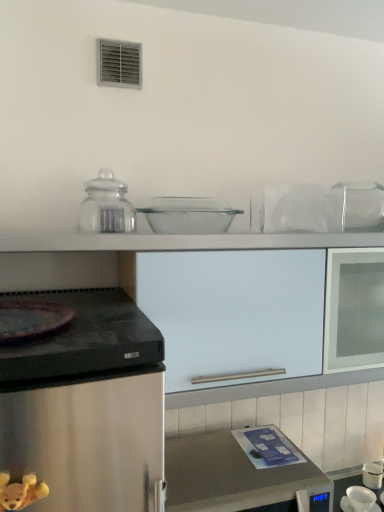
At what (x,y) coordinates should I click in order to perform the action: click on white matte cabinet at center. Please return your answer as a coordinate pair (x, y). The height and width of the screenshot is (512, 384). Looking at the image, I should click on (231, 325).

Measure the distance between point (x=156, y=203) and camera.

Point (x=156, y=203) and camera are 1.46 meters apart from each other.

What is the approximate height of transparent glass jar at upper center?

transparent glass jar at upper center is 6.88 inches tall.

What do you see at coordinates (20, 492) in the screenshot? I see `brown plush bear at lower left` at bounding box center [20, 492].

Image resolution: width=384 pixels, height=512 pixels. I want to click on white matte cabinet at center, so click(231, 325).

Is transparent glass jar at upper center surrounded by white glossy cup at lower right, which is the first appliance from right to left?

No.

Which of these two, white glossy cup at lower right, which is the first appliance from right to left, or transparent glass jar at upper center, is bigger?

Bigger between the two is transparent glass jar at upper center.

Is white glossy cup at lower right, which ranks as the 2th appliance in front-to-back order, facing away from transparent glass jar at upper center?

No.

The image size is (384, 512). Identify the location of home appliance below the white matte cabinet at center (from the image's perspective). (235, 477).

Can we say metallic stainless steel microwave at lower center lies outside white matte cabinet at center?

That's correct, metallic stainless steel microwave at lower center is outside of white matte cabinet at center.

Considering the sizes of objects metallic stainless steel microwave at lower center and white matte cabinet at center in the image provided, who is wider, metallic stainless steel microwave at lower center or white matte cabinet at center?

With larger width is metallic stainless steel microwave at lower center.

Is metallic stainless steel microwave at lower center turned away from white matte cabinet at center?

No, white matte cabinet at center is not at the back of metallic stainless steel microwave at lower center.

Do you think white matte cabinet at center is within white glossy cup at lower right, which is the second appliance from left to right, or outside of it?

white matte cabinet at center is located beyond the bounds of white glossy cup at lower right, which is the second appliance from left to right.

Is white matte cabinet at center aimed at white glossy cup at lower right, which appears as the 2th appliance when viewed from the top?

No, white matte cabinet at center is not turned towards white glossy cup at lower right, which appears as the 2th appliance when viewed from the top.

I want to click on cabinetry on the left of white glossy cup at lower right, which is the first appliance from right to left, so (x=231, y=325).

From the image's perspective, is white matte cabinet at center on white glossy cup at lower right, which is the second appliance from left to right?

Correct, white matte cabinet at center appears higher than white glossy cup at lower right, which is the second appliance from left to right, in the image.

From the picture: Is the position of white glossy cup at lower right, which appears as the 2th appliance when viewed from the top, more distant than that of clear glass bowl at center, which is the first appliance from front to back?

Yes, it is behind clear glass bowl at center, which is the first appliance from front to back.

Considering the relative sizes of white glossy cup at lower right, which is the second appliance from left to right, and clear glass bowl at center, acting as the 1th appliance starting from the left, in the image provided, is white glossy cup at lower right, which is the second appliance from left to right, wider than clear glass bowl at center, acting as the 1th appliance starting from the left,?

Incorrect, the width of white glossy cup at lower right, which is the second appliance from left to right, does not surpass that of clear glass bowl at center, acting as the 1th appliance starting from the left.

Considering the relative positions of white glossy cup at lower right, which is the first appliance from right to left, and clear glass bowl at center, which appears as the second appliance when viewed from the back, in the image provided, is white glossy cup at lower right, which is the first appliance from right to left, to the right of clear glass bowl at center, which appears as the second appliance when viewed from the back, from the viewer's perspective?

Correct, you'll find white glossy cup at lower right, which is the first appliance from right to left, to the right of clear glass bowl at center, which appears as the second appliance when viewed from the back.

Could you tell me if white glossy cup at lower right, which appears as the 2th appliance when viewed from the top, is facing clear glass bowl at center, which is the 1th appliance from top to bottom?

No, white glossy cup at lower right, which appears as the 2th appliance when viewed from the top, is not turned towards clear glass bowl at center, which is the 1th appliance from top to bottom.

Are clear glass bowl at center, which is the 1th appliance from top to bottom, and white matte cabinet at center located far from each other?

No, clear glass bowl at center, which is the 1th appliance from top to bottom, is not far from white matte cabinet at center.

Considering the sizes of objects clear glass bowl at center, which is the first appliance from front to back, and white matte cabinet at center in the image provided, who is wider, clear glass bowl at center, which is the first appliance from front to back, or white matte cabinet at center?

white matte cabinet at center.

Identify the location of cabinetry that is in front of the clear glass bowl at center, which is the 1th appliance from top to bottom. (231, 325).

From a real-world perspective, which is physically below, white glossy cup at lower right, which is the first appliance from right to left, or brown plush bear at lower left?

From a 3D spatial view, white glossy cup at lower right, which is the first appliance from right to left, is below.

From the picture: Does white glossy cup at lower right, which ranks as the 2th appliance in front-to-back order, turn towards brown plush bear at lower left?

No, white glossy cup at lower right, which ranks as the 2th appliance in front-to-back order, is not aimed at brown plush bear at lower left.

Considering the relative positions of white glossy cup at lower right, positioned as the first appliance in bottom-to-top order, and brown plush bear at lower left in the image provided, is white glossy cup at lower right, positioned as the first appliance in bottom-to-top order, to the left of brown plush bear at lower left from the viewer's perspective?

In fact, white glossy cup at lower right, positioned as the first appliance in bottom-to-top order, is to the right of brown plush bear at lower left.

From the image's perspective, is white glossy cup at lower right, which ranks as the 2th appliance in front-to-back order, over brown plush bear at lower left?

No, from the image's perspective, white glossy cup at lower right, which ranks as the 2th appliance in front-to-back order, is not on top of brown plush bear at lower left.

In the scene shown: Is metallic stainless steel microwave at lower center turned away from brown plush bear at lower left?

metallic stainless steel microwave at lower center does not have its back to brown plush bear at lower left.

Which object is positioned more to the right, metallic stainless steel microwave at lower center or brown plush bear at lower left?

Positioned to the right is metallic stainless steel microwave at lower center.

Is point (332, 487) closer or farther from the camera than point (1, 475)?

Point (332, 487) is farther from the camera than point (1, 475).

Is metallic stainless steel microwave at lower center in front of or behind brown plush bear at lower left in the image?

metallic stainless steel microwave at lower center is positioned farther from the viewer than brown plush bear at lower left.

Locate an element on the screen. The image size is (384, 512). the 2nd appliance to the right of the transparent glass jar at upper center, starting your count from the anchor is located at coordinates (359, 500).

This screenshot has width=384, height=512. In order to click on cabinetry in front of the metallic stainless steel microwave at lower center in this screenshot , I will do `click(231, 325)`.

When comparing their distances from white matte cabinet at center, does white glossy cup at lower right, which appears as the 2th appliance when viewed from the top, or brown plush bear at lower left seem further?

Based on the image, white glossy cup at lower right, which appears as the 2th appliance when viewed from the top, appears to be further to white matte cabinet at center.

When comparing their distances from metallic stainless steel microwave at lower center, does white matte cabinet at center or white glossy cup at lower right, which ranks as the 2th appliance in front-to-back order, seem further?

white glossy cup at lower right, which ranks as the 2th appliance in front-to-back order, is positioned further to the anchor metallic stainless steel microwave at lower center.

From the image, which object appears to be farther from transparent glass jar at upper center, white matte cabinet at center or brown plush bear at lower left?

brown plush bear at lower left.

From the image, which object appears to be nearer to white matte cabinet at center, brown plush bear at lower left or transparent glass jar at upper center?

transparent glass jar at upper center lies closer to white matte cabinet at center than the other object.

From the image, which object appears to be farther from white glossy cup at lower right, positioned as the first appliance in back-to-front order, transparent glass jar at upper center or white matte cabinet at center?

transparent glass jar at upper center is positioned further to the anchor white glossy cup at lower right, positioned as the first appliance in back-to-front order.

From the image, which object appears to be farther from brown plush bear at lower left, white glossy cup at lower right, which appears as the 2th appliance when viewed from the top, or clear glass bowl at center, which appears as the second appliance when viewed from the back?

Among the two, white glossy cup at lower right, which appears as the 2th appliance when viewed from the top, is located further to brown plush bear at lower left.

Looking at the image, which one is located further to brown plush bear at lower left, white matte cabinet at center or metallic stainless steel microwave at lower center?

Among the two, white matte cabinet at center is located further to brown plush bear at lower left.

Estimate the real-world distances between objects in this image. Which object is closer to white glossy cup at lower right, which appears as the 2th appliance when viewed from the top, transparent glass jar at upper center or brown plush bear at lower left?

brown plush bear at lower left is positioned closer to the anchor white glossy cup at lower right, which appears as the 2th appliance when viewed from the top.

Where is `toy between transparent glass jar at upper center and metallic stainless steel microwave at lower center vertically`? This screenshot has height=512, width=384. toy between transparent glass jar at upper center and metallic stainless steel microwave at lower center vertically is located at coordinates (20, 492).

At what (x,y) coordinates should I click in order to perform the action: click on toy that lies between transparent glass jar at upper center and white glossy cup at lower right, which ranks as the 2th appliance in front-to-back order, from top to bottom. Please return your answer as a coordinate pair (x, y). The image size is (384, 512). Looking at the image, I should click on point(20,492).

The image size is (384, 512). I want to click on appliance between transparent glass jar at upper center and white glossy cup at lower right, which ranks as the 2th appliance in front-to-back order, in the vertical direction, so click(x=189, y=215).

Identify the location of home appliance between clear glass bowl at center, the second appliance positioned from the bottom, and white glossy cup at lower right, positioned as the first appliance in bottom-to-top order, in the up-down direction. This screenshot has width=384, height=512. (235, 477).